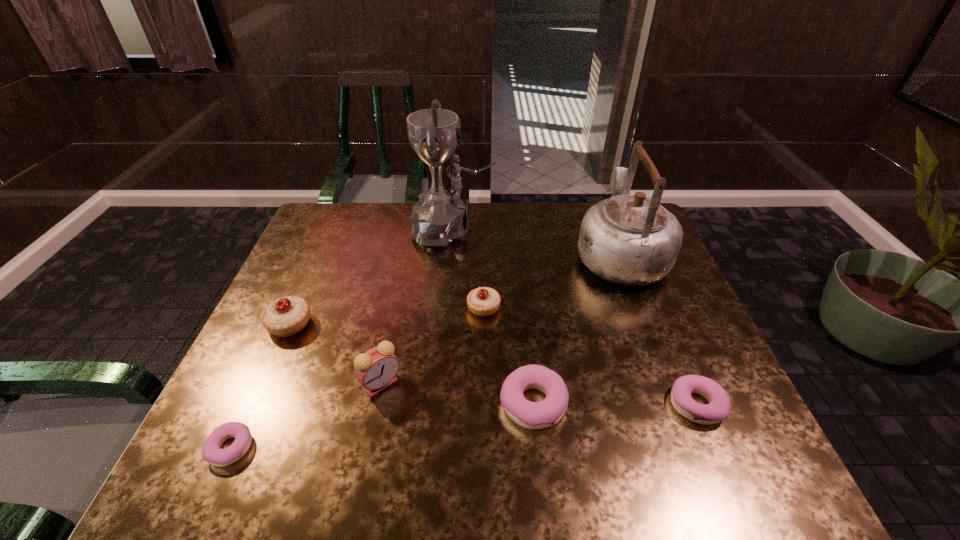
Where is `vacant space at the far edge`? Image resolution: width=960 pixels, height=540 pixels. vacant space at the far edge is located at coordinates (559, 233).

You are a GUI agent. You are given a task and a screenshot of the screen. Output one action in this format:
    pyautogui.click(x=<x>, y=<y>)
    Task: Click on the free region at the left edge of the desktop
    
    Given the screenshot: What is the action you would take?
    pyautogui.click(x=287, y=362)

Where is `vacant area at the right edge`? The height and width of the screenshot is (540, 960). vacant area at the right edge is located at coordinates (685, 326).

You are a GUI agent. You are given a task and a screenshot of the screen. Output one action in this format:
    pyautogui.click(x=<x>, y=<y>)
    Task: Click on the vacant space at the far left corner of the desktop
    
    Given the screenshot: What is the action you would take?
    pyautogui.click(x=332, y=203)

Where is `free space between the pink alarm clock and the tallest object`? This screenshot has width=960, height=540. free space between the pink alarm clock and the tallest object is located at coordinates (417, 307).

This screenshot has width=960, height=540. Identify the location of vacant point located between the shortest pastry and the bigger beige pastry. (260, 386).

Where is `free space between the tallest pastry and the award`? The image size is (960, 540). free space between the tallest pastry and the award is located at coordinates (371, 277).

I want to click on free area in between the shortest object and the second smallest pink pastry, so click(x=464, y=426).

This screenshot has width=960, height=540. What are the coordinates of `empty location between the sixth tallest object and the kettle` in the screenshot? It's located at (576, 329).

Identify the location of free area in between the left beige pastry and the seventh shortest object. The width and height of the screenshot is (960, 540). (455, 289).